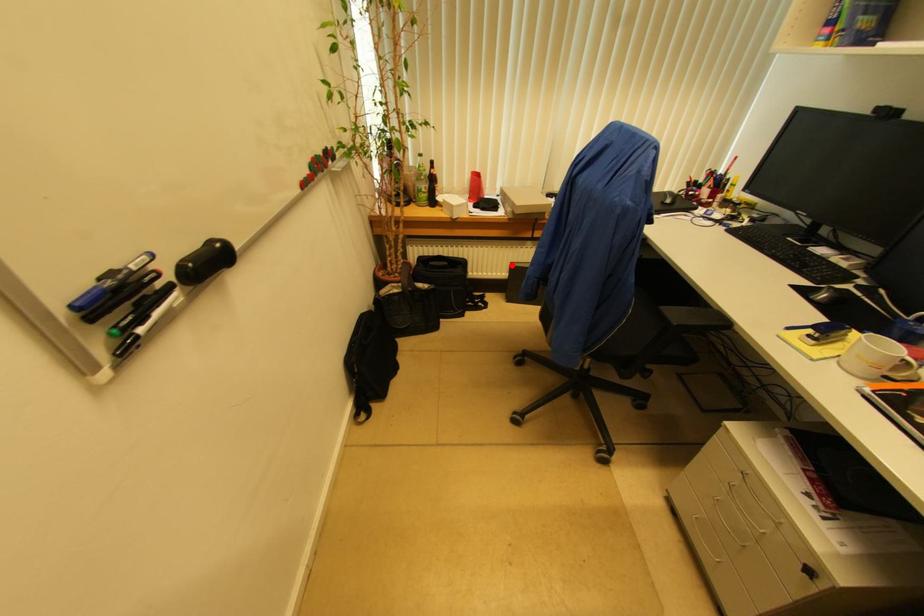
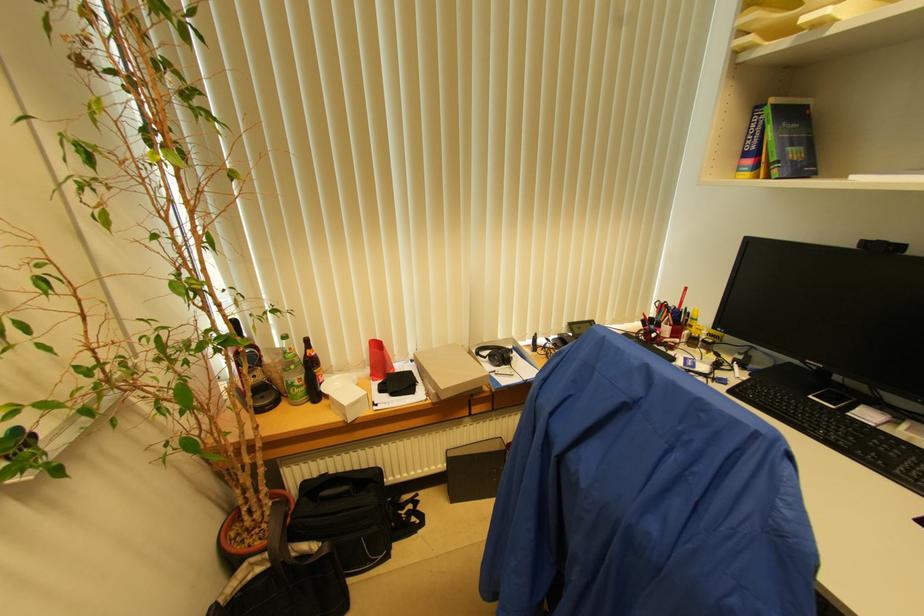
Question: I am providing you with two images of the same scene from different viewpoints. Image1 has a red point marked. In image2, the corresponding 3D location appears at what relative position? Reply with the corresponding letter.

Choices:
 (A) Closer
 (B) Farther

Answer: (B)